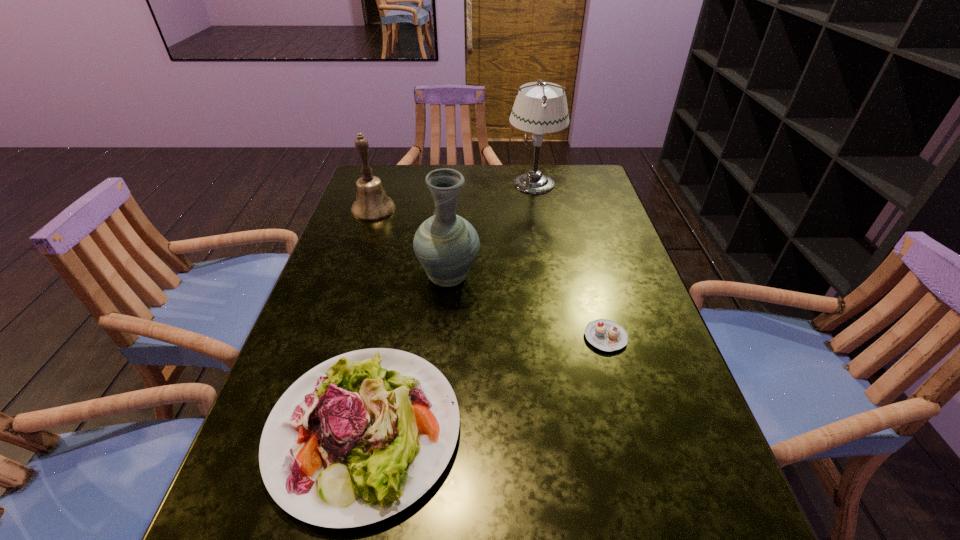
Identify the location of vacant region located on the lampshade of the farthest object. This screenshot has width=960, height=540. (420, 183).

The height and width of the screenshot is (540, 960). Identify the location of free space located 0.100m on the handle side of the third nearest object. (452, 236).

Where is `vacant space located on the handle side of the third nearest object`? vacant space located on the handle side of the third nearest object is located at coordinates (453, 230).

I want to click on vacant area situated on the handle side of the third nearest object, so click(x=456, y=185).

Locate an element on the screen. vacant area located on the front of the second farthest object is located at coordinates (334, 325).

Identify the location of free region located on the back of the second shortest object. The image size is (960, 540). (405, 243).

The image size is (960, 540). What are the coordinates of `vacant space located 0.310m on the front of the cupcake` in the screenshot? It's located at (656, 516).

The image size is (960, 540). I want to click on lampshade that is positioned at the far edge, so click(x=543, y=109).

At what (x,y) coordinates should I click in order to perform the action: click on bell present at the far edge. Please return your answer as a coordinate pair (x, y). Looking at the image, I should click on (372, 204).

Locate an element on the screen. Image resolution: width=960 pixels, height=540 pixels. bell that is at the left edge is located at coordinates (372, 204).